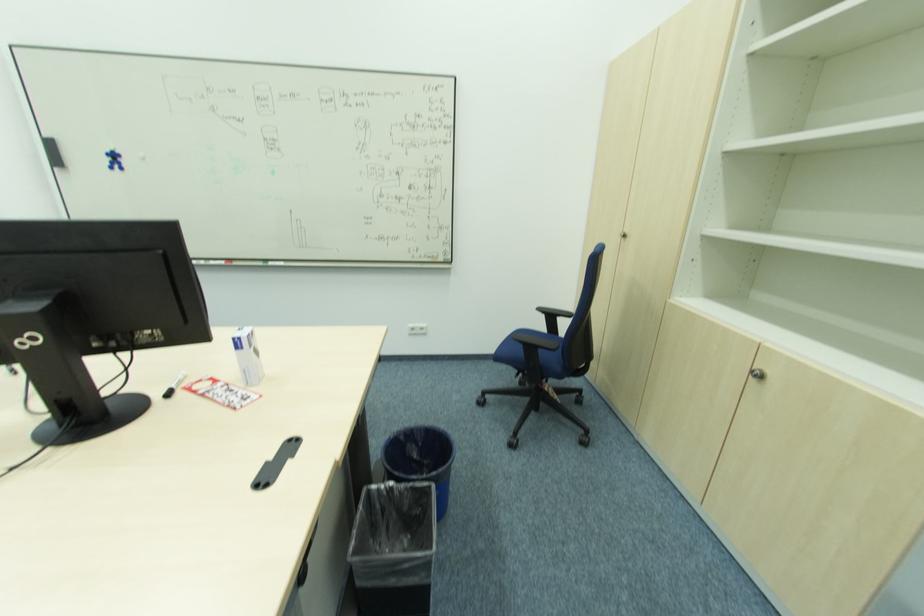
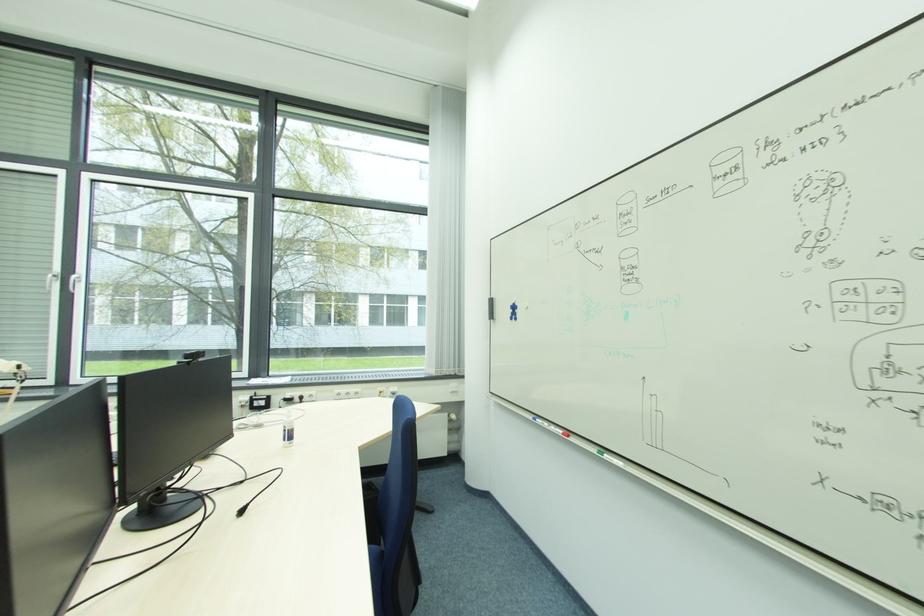
Find the pixel in the second image that matches point 116,161 in the first image.

(515, 313)